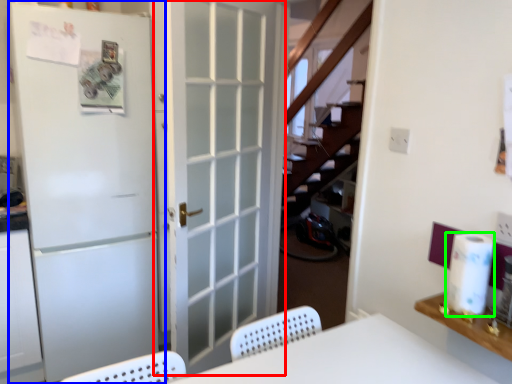
Question: Which is farther away from door (highlighted by a red box)? door (highlighted by a blue box) or paper towel (highlighted by a green box)?

Choices:
 (A) door
 (B) paper towel

Answer: (B)